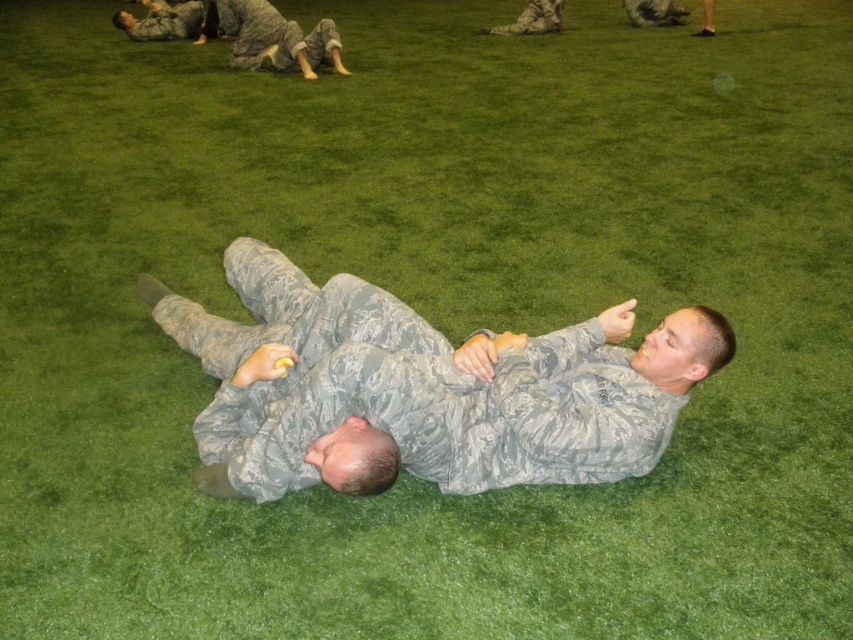
You are a drone operator trying to locate a specific point in an image. The scene shows two people in camouflage uniforms on green artificial turf. There is a point labeled at coordinates (422, 388). Which object in the scene does this point correspond to?

The point at coordinates (422, 388) corresponds to the camouflage fabric man at center.

From the picture: You are a military trainer assessing the positioning of two trainees during a drill. The camouflage fabric man at upper center and the camouflage uniform at upper left are part of the exercise. Based on their spatial arrangement, which trainee occupies a wider area in the image?

The camouflage fabric man at upper center might be wider than the camouflage uniform at upper left, so the camouflage fabric man at upper center occupies a wider area in the image.